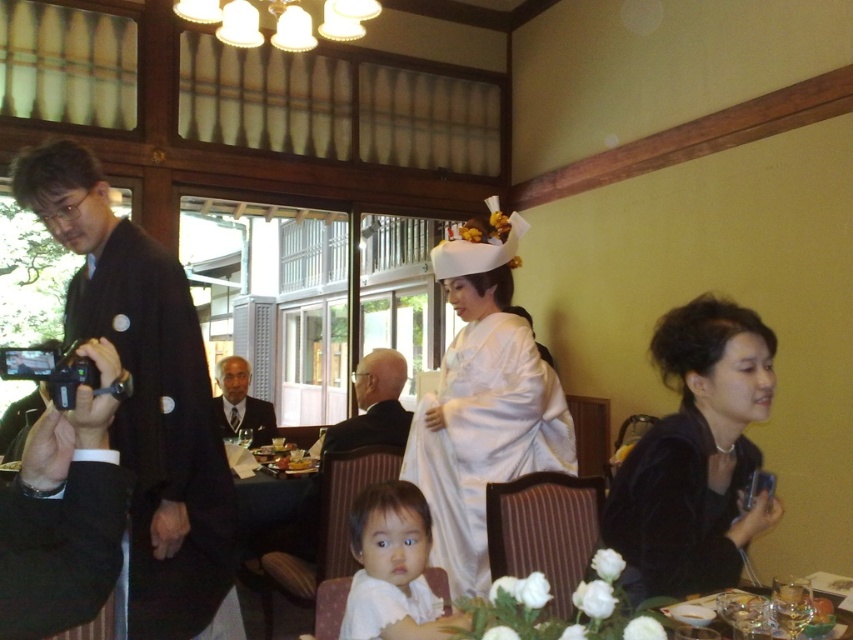
Does black kimono at left have a smaller size compared to white silk kimono at center?

Indeed, black kimono at left has a smaller size compared to white silk kimono at center.

Can you confirm if black kimono at left is positioned to the left of white silk kimono at center?

Indeed, black kimono at left is positioned on the left side of white silk kimono at center.

Is point (33, 193) positioned before point (421, 420)?

Yes, point (33, 193) is in front of point (421, 420).

Where is `black kimono at left`? Image resolution: width=853 pixels, height=640 pixels. black kimono at left is located at coordinates (148, 397).

Is black kimono at left positioned at the back of black velvet dress at lower right?

No, black kimono at left is in front of black velvet dress at lower right.

Find the location of a particular element. black kimono at left is located at coordinates (148, 397).

Where is `black kimono at left`? black kimono at left is located at coordinates (148, 397).

Who is taller, white matte/soft baby at center or white silk robe at lower center?

With more height is white matte/soft baby at center.

Can you confirm if white matte/soft baby at center is bigger than white silk robe at lower center?

Yes.

Identify the location of white matte/soft baby at center. Image resolution: width=853 pixels, height=640 pixels. (387, 561).